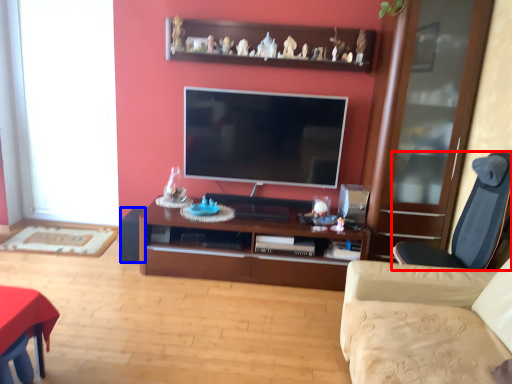
Question: Which object is closer to the camera taking this photo, chair (highlighted by a red box) or speaker (highlighted by a blue box)?

Choices:
 (A) chair
 (B) speaker

Answer: (A)